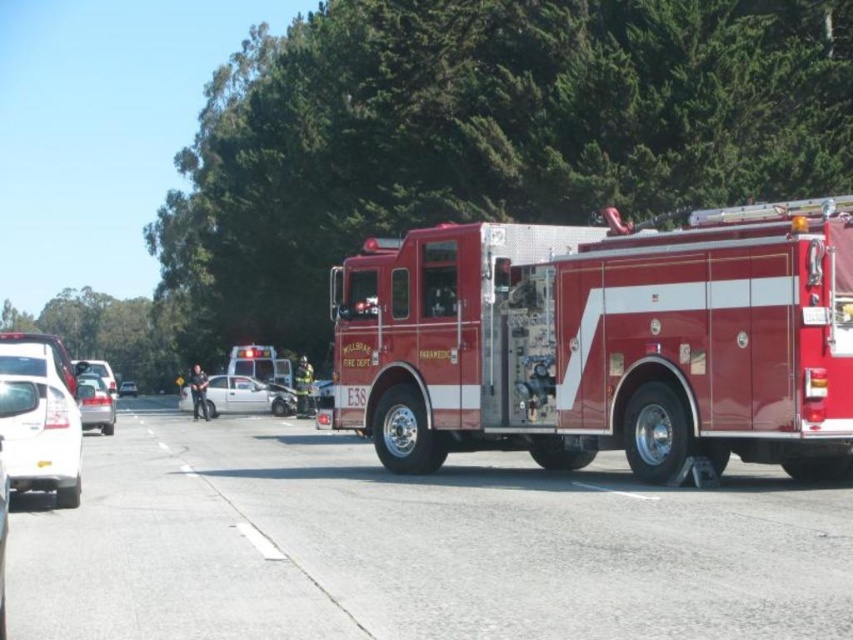
Who is taller, silver metallic sedan at left or white glossy sedan at center?

Standing taller between the two is white glossy sedan at center.

Does silver metallic sedan at left appear on the left side of white glossy sedan at center?

In fact, silver metallic sedan at left is to the right of white glossy sedan at center.

Find the location of `silver metallic sedan at left`. silver metallic sedan at left is located at coordinates (96, 403).

Is point (368, 308) less distant than point (61, 497)?

That is False.

Can you confirm if shiny red fire truck at center is positioned above white glossy sedan at lower left?

Indeed, shiny red fire truck at center is positioned over white glossy sedan at lower left.

The width and height of the screenshot is (853, 640). Find the location of `shiny red fire truck at center`. shiny red fire truck at center is located at coordinates (602, 340).

Is the position of silver metallic sedan at center less distant than that of white glossy sedan at center?

Yes, it is.

Can you confirm if silver metallic sedan at center is positioned to the right of white glossy sedan at center?

Correct, you'll find silver metallic sedan at center to the right of white glossy sedan at center.

What are the coordinates of `silver metallic sedan at center` in the screenshot? It's located at (247, 396).